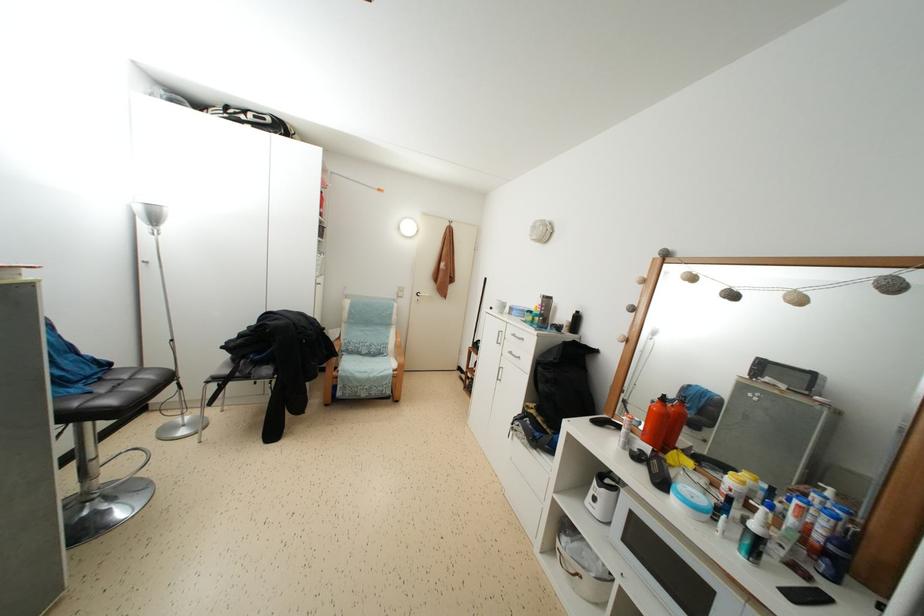
The width and height of the screenshot is (924, 616). What do you see at coordinates (755, 536) in the screenshot?
I see `the white spray bottle` at bounding box center [755, 536].